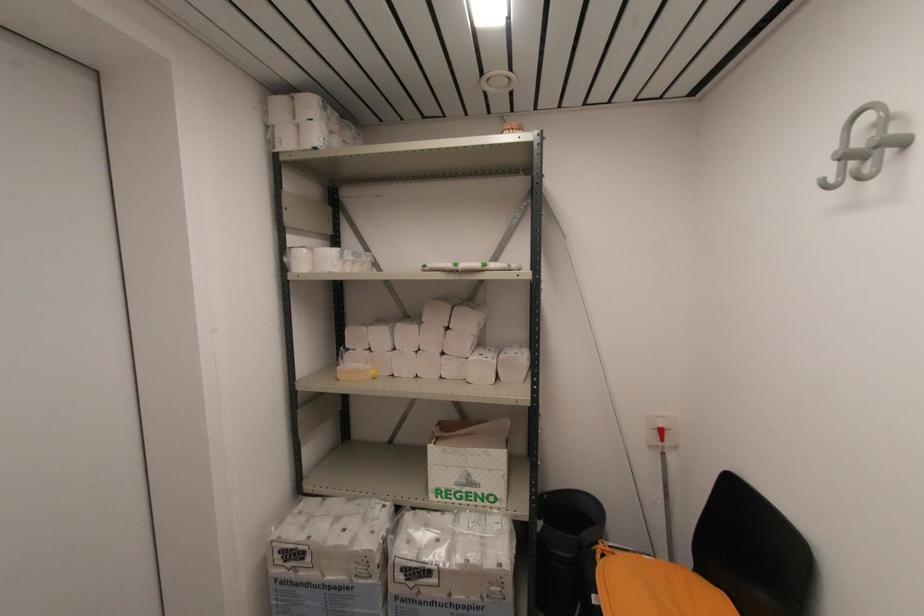
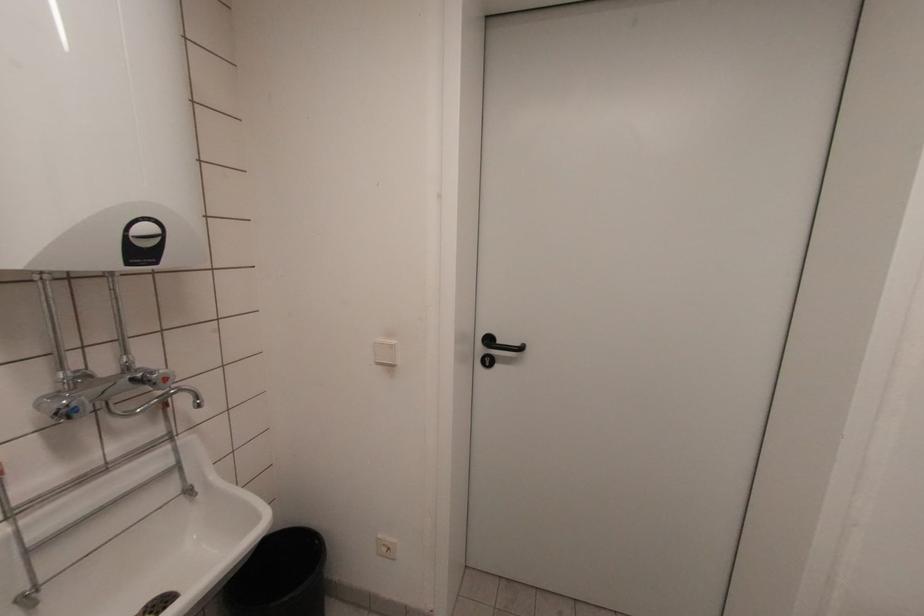
Question: The first image is from the beginning of the video and the second image is from the end. How did the camera likely rotate when shooting the video?

Choices:
 (A) Left
 (B) Right
 (C) Up
 (D) Down

Answer: (A)